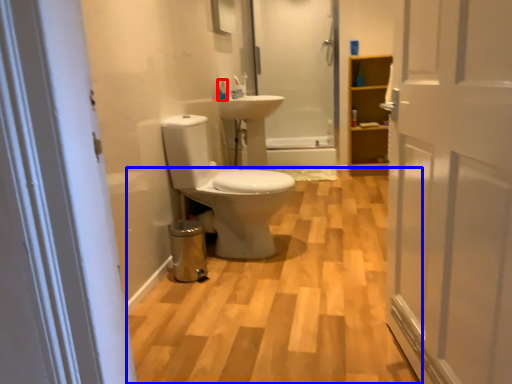
Question: Which object is closer to the camera taking this photo, toiletry (highlighted by a red box) or plain (highlighted by a blue box)?

Choices:
 (A) toiletry
 (B) plain

Answer: (B)